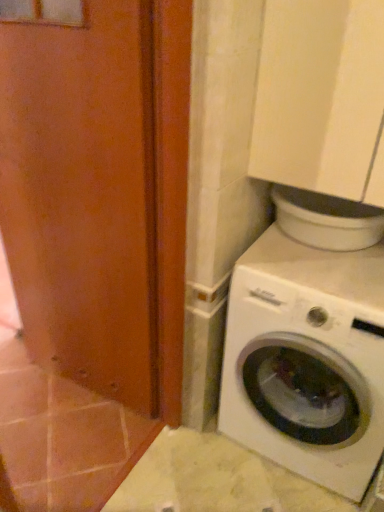
Question: Can you confirm if white matte washing machine at lower right is taller than matte orange screen door at left?

Choices:
 (A) no
 (B) yes

Answer: (A)

Question: Is white matte washing machine at lower right far from matte orange screen door at left?

Choices:
 (A) yes
 (B) no

Answer: (B)

Question: From the image's perspective, is white matte washing machine at lower right beneath matte orange screen door at left?

Choices:
 (A) yes
 (B) no

Answer: (A)

Question: Can you confirm if white matte washing machine at lower right is wider than matte orange screen door at left?

Choices:
 (A) no
 (B) yes

Answer: (B)

Question: Considering the relative sizes of white matte washing machine at lower right and matte orange screen door at left in the image provided, is white matte washing machine at lower right shorter than matte orange screen door at left?

Choices:
 (A) no
 (B) yes

Answer: (B)

Question: Is white matte washing machine at lower right in contact with matte orange screen door at left?

Choices:
 (A) no
 (B) yes

Answer: (A)

Question: From the image's perspective, is matte orange screen door at left under white matte washing machine at lower right?

Choices:
 (A) yes
 (B) no

Answer: (B)

Question: Is the depth of matte orange screen door at left less than that of white matte washing machine at lower right?

Choices:
 (A) no
 (B) yes

Answer: (B)

Question: Is matte orange screen door at left thinner than white matte washing machine at lower right?

Choices:
 (A) yes
 (B) no

Answer: (A)

Question: Considering the relative sizes of matte orange screen door at left and white matte washing machine at lower right in the image provided, is matte orange screen door at left shorter than white matte washing machine at lower right?

Choices:
 (A) no
 (B) yes

Answer: (A)

Question: Is matte orange screen door at left further to the viewer compared to white matte washing machine at lower right?

Choices:
 (A) no
 (B) yes

Answer: (A)

Question: From a real-world perspective, is matte orange screen door at left positioned over white matte washing machine at lower right based on gravity?

Choices:
 (A) yes
 (B) no

Answer: (A)

Question: From the image's perspective, is white matte washing machine at lower right located above or below matte orange screen door at left?

Choices:
 (A) above
 (B) below

Answer: (B)